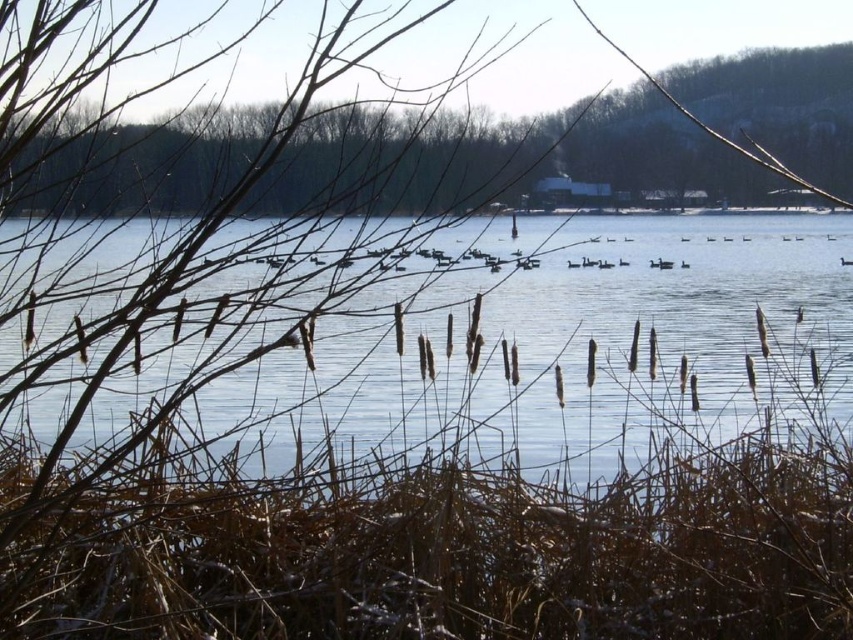
Who is positioned more to the left, brown reeds at center or brown textured cattails at center?

Positioned to the left is brown reeds at center.

Looking at this image, can you confirm if brown reeds at center is positioned above brown textured cattails at center?

Incorrect, brown reeds at center is not positioned above brown textured cattails at center.

Is point (572, 413) in front of point (676, 67)?

Yes, point (572, 413) is in front of point (676, 67).

Locate an element on the screen. brown reeds at center is located at coordinates (566, 348).